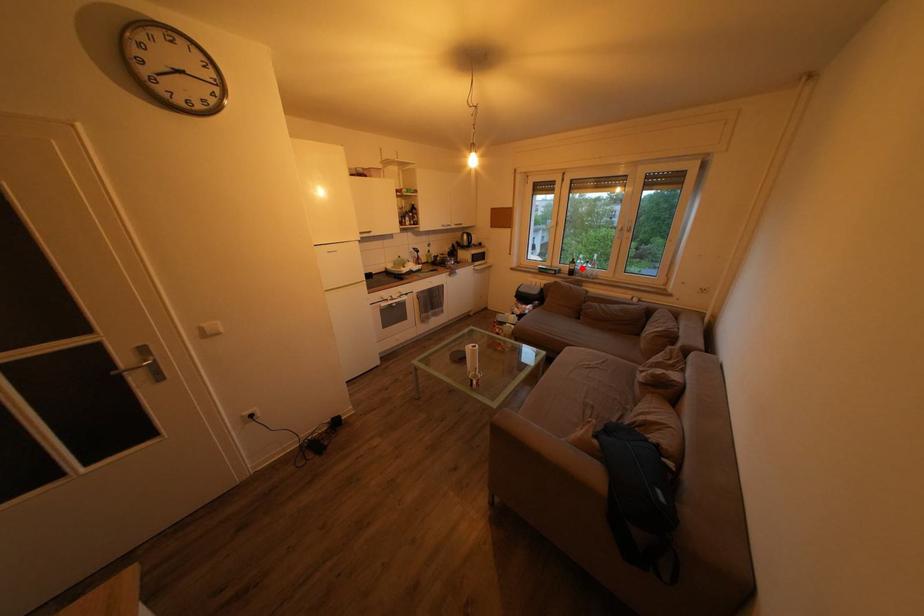
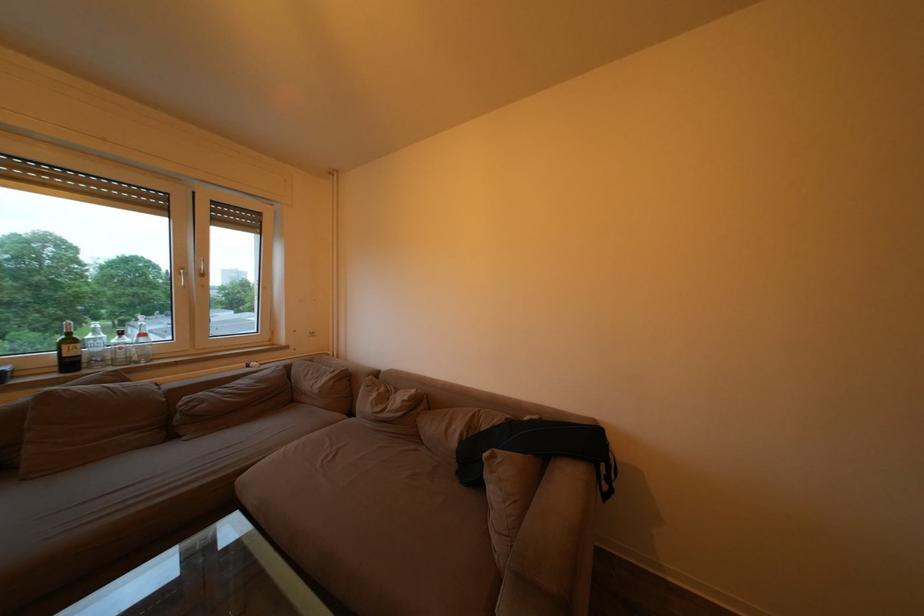
In the second image, find the point that corresponds to the highlighted location in the first image.

(79, 347)